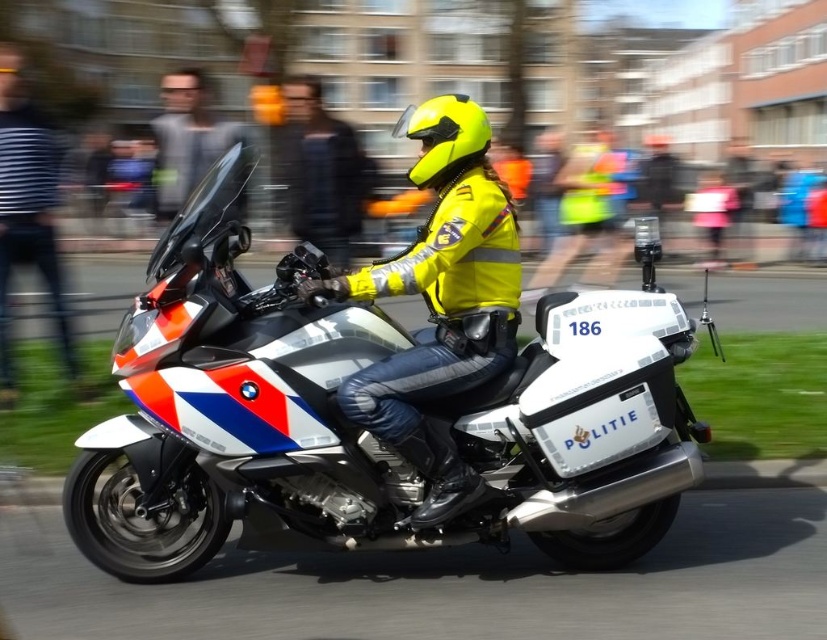
This screenshot has height=640, width=827. What do you see at coordinates (440, 301) in the screenshot? I see `high-visibility yellow jacket at center` at bounding box center [440, 301].

Can you confirm if high-visibility yellow jacket at center is wider than yellow reflective jacket at center?

No.

Does point (417, 248) come behind point (295, 186)?

No, it is not.

The height and width of the screenshot is (640, 827). I want to click on high-visibility yellow jacket at center, so click(x=440, y=301).

Does yellow reflective jacket at center have a smaller size compared to yellow matte helmet at center?

Incorrect, yellow reflective jacket at center is not smaller in size than yellow matte helmet at center.

Which is more to the left, yellow reflective jacket at center or yellow matte helmet at center?

yellow reflective jacket at center

Is point (335, 177) more distant than point (457, 170)?

Yes, it is.

The width and height of the screenshot is (827, 640). Find the location of `yellow reflective jacket at center`. yellow reflective jacket at center is located at coordinates (321, 172).

Can you confirm if white-police motorcycle at center is shorter than striped fabric shirt at left?

Indeed, white-police motorcycle at center has a lesser height compared to striped fabric shirt at left.

Does white-police motorcycle at center have a lesser width compared to striped fabric shirt at left?

No.

Does point (486, 356) come in front of point (13, 166)?

Yes.

This screenshot has height=640, width=827. Find the location of `white-police motorcycle at center`. white-police motorcycle at center is located at coordinates (366, 429).